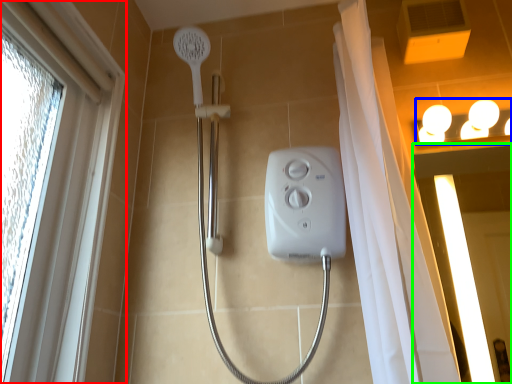
Question: Based on their relative distances, which object is farther from window (highlighted by a red box)? Choose from light fixture (highlighted by a blue box) and screen door (highlighted by a green box).

Choices:
 (A) light fixture
 (B) screen door

Answer: (B)